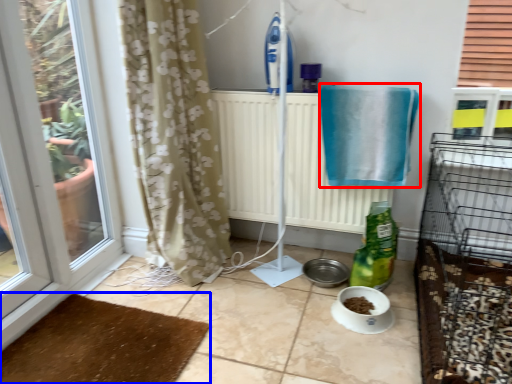
Question: Which object appears closest to the camera in this image, bath towel (highlighted by a red box) or doormat (highlighted by a blue box)?

Choices:
 (A) bath towel
 (B) doormat

Answer: (B)